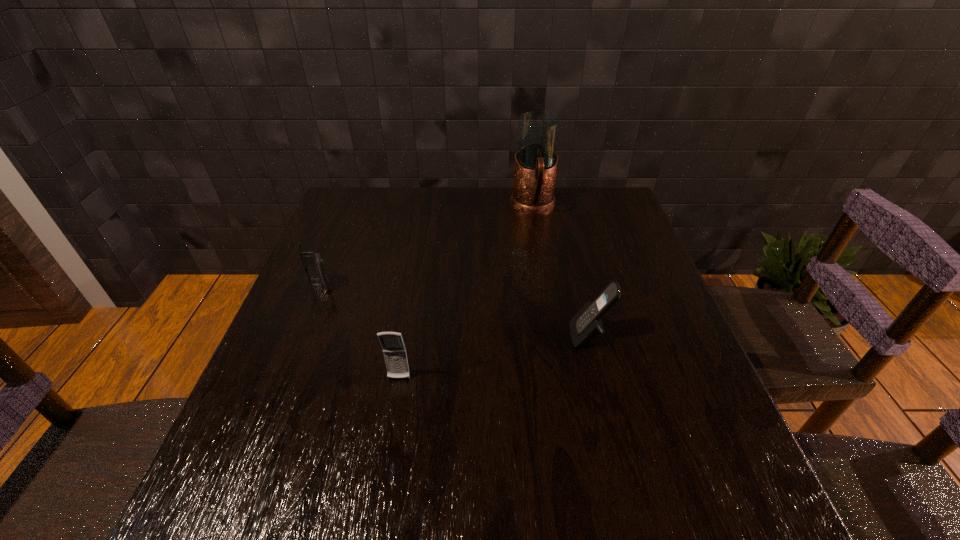
In order to click on pitcher in this screenshot , I will do `click(535, 165)`.

Identify the location of the tallest object. The height and width of the screenshot is (540, 960). (535, 165).

At what (x,y) coordinates should I click in order to perform the action: click on the second nearest object. Please return your answer as a coordinate pair (x, y). Looking at the image, I should click on coord(586,327).

This screenshot has height=540, width=960. In order to click on the rightmost cellular telephone in this screenshot , I will do `click(586, 327)`.

Where is `the nearest object`? The image size is (960, 540). the nearest object is located at coordinates (x=394, y=350).

At what (x,y) coordinates should I click in order to perform the action: click on the second object from left to right. Please return your answer as a coordinate pair (x, y). Image resolution: width=960 pixels, height=540 pixels. Looking at the image, I should click on (394, 350).

This screenshot has width=960, height=540. In order to click on the third nearest object in this screenshot , I will do `click(313, 263)`.

Find the location of a particular element. This screenshot has height=540, width=960. the shortest object is located at coordinates (313, 263).

I want to click on free spot located 0.210m with the handle on the side of the pitcher, so click(x=543, y=268).

Locate an element on the screen. Image resolution: width=960 pixels, height=540 pixels. vacant space located 0.190m on the front-facing side of the rightmost cellular telephone is located at coordinates (487, 336).